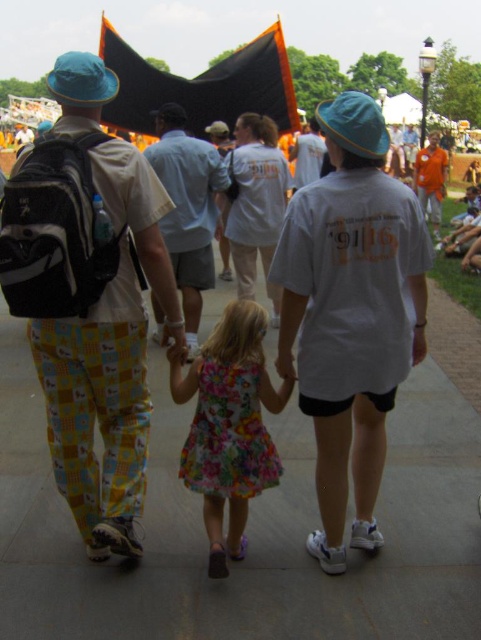
You are standing at the origin of the coordinate system in this image. There is a point marked at coordinate (228, 426). What object is located at that point?

The point at coordinate (228, 426) marks the floral fabric dress at center.

In the scene shown: You are a photographer trying to capture the group of three people in the scene. You notice the floral fabric dress at center and the white matte shirt at center. Which clothing item is closer to the bottom of the photo?

The floral fabric dress at center is positioned under the white matte shirt at center, so the floral fabric dress at center is closer to the bottom of the photo.